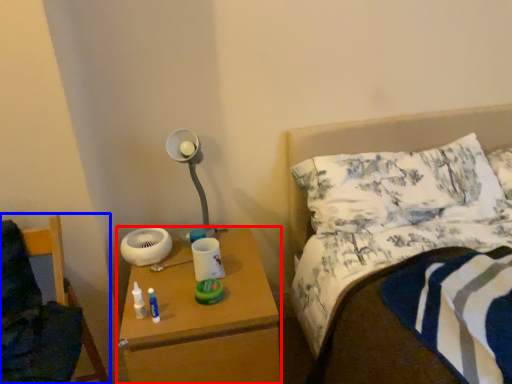
Question: Which object is closer to the camera taking this photo, nightstand (highlighted by a red box) or furniture (highlighted by a blue box)?

Choices:
 (A) nightstand
 (B) furniture

Answer: (B)